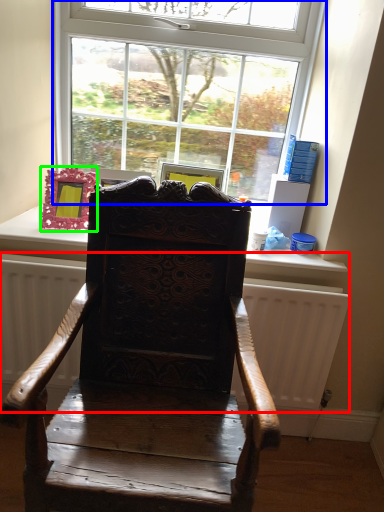
Question: Based on their relative distances, which object is nearer to radiator (highlighted by a red box)? Choose from window (highlighted by a blue box) and picture frame (highlighted by a green box).

Choices:
 (A) window
 (B) picture frame

Answer: (B)